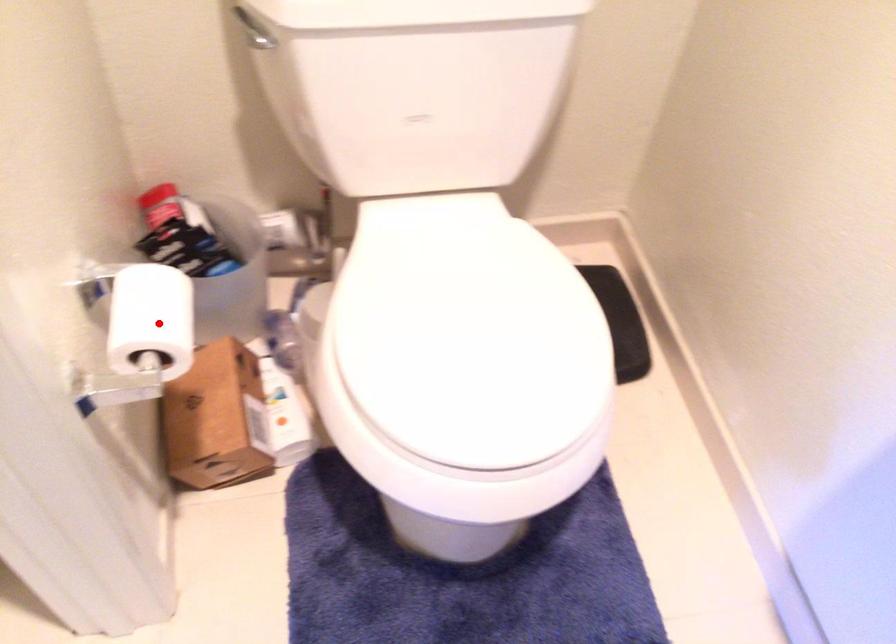
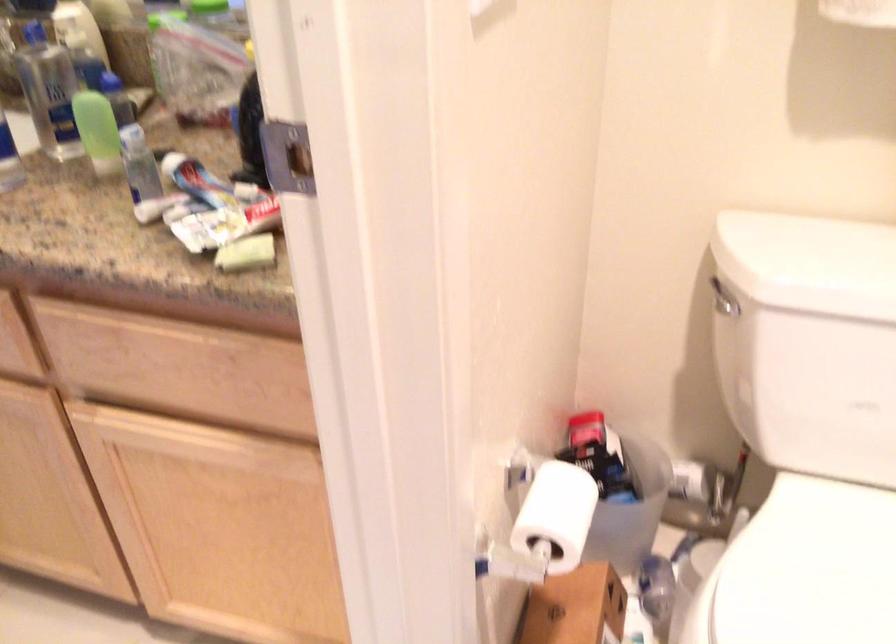
The point at the highlighted location is marked in the first image. Where is the corresponding point in the second image?

(556, 515)